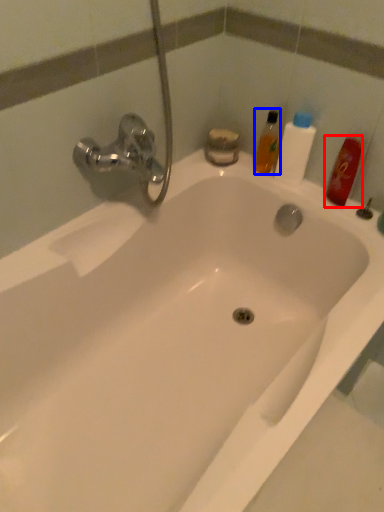
Question: Which object appears farthest to the camera in this image, mouthwash (highlighted by a red box) or mouthwash (highlighted by a blue box)?

Choices:
 (A) mouthwash
 (B) mouthwash

Answer: (B)